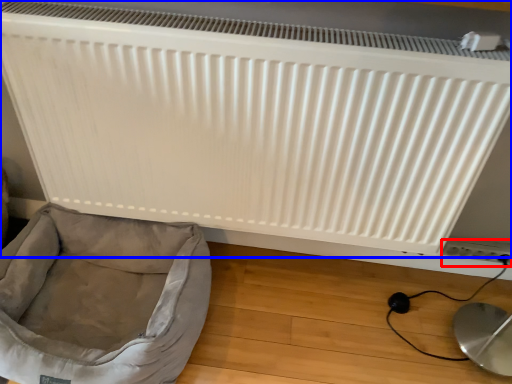
Question: Among these objects, which one is farthest to the camera, electric outlet (highlighted by a red box) or radiator (highlighted by a blue box)?

Choices:
 (A) electric outlet
 (B) radiator

Answer: (A)